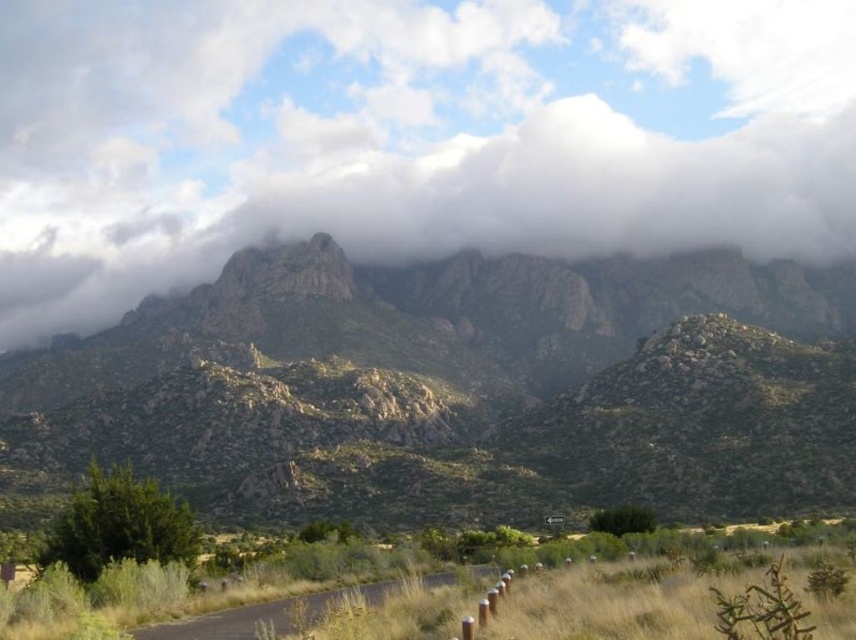
Between white fluffy cloud at upper center and rocky mountain range at upper center, which one appears on the right side from the viewer's perspective?

From the viewer's perspective, white fluffy cloud at upper center appears more on the right side.

Is white fluffy cloud at upper center positioned before rocky mountain range at upper center?

No.

Identify the location of white fluffy cloud at upper center. (407, 136).